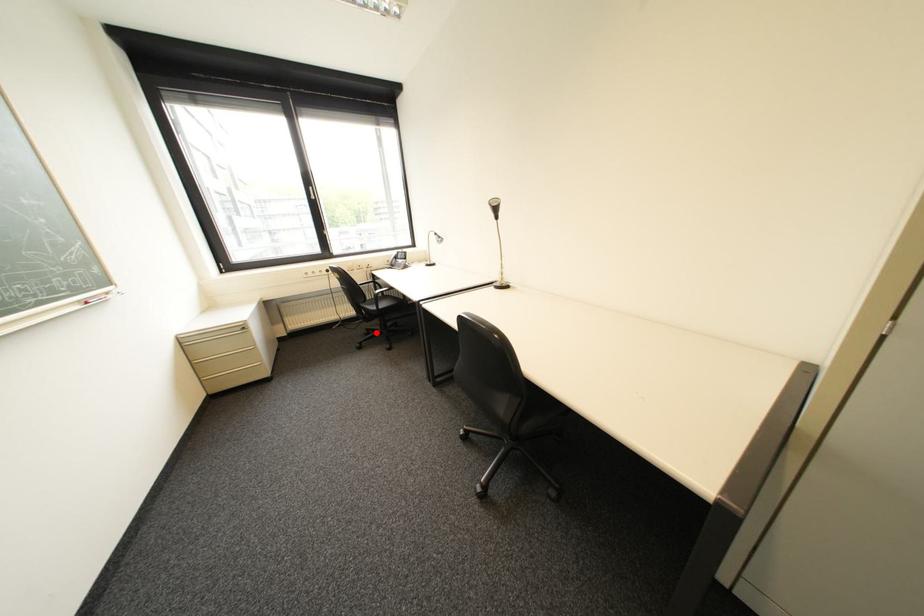
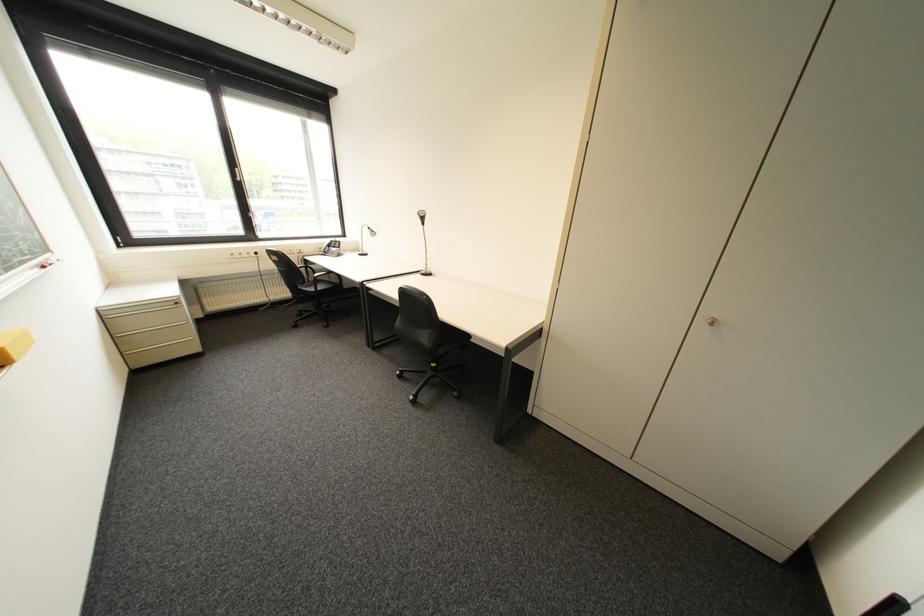
The point at the highlighted location is marked in the first image. Where is the corresponding point in the second image?

(309, 314)